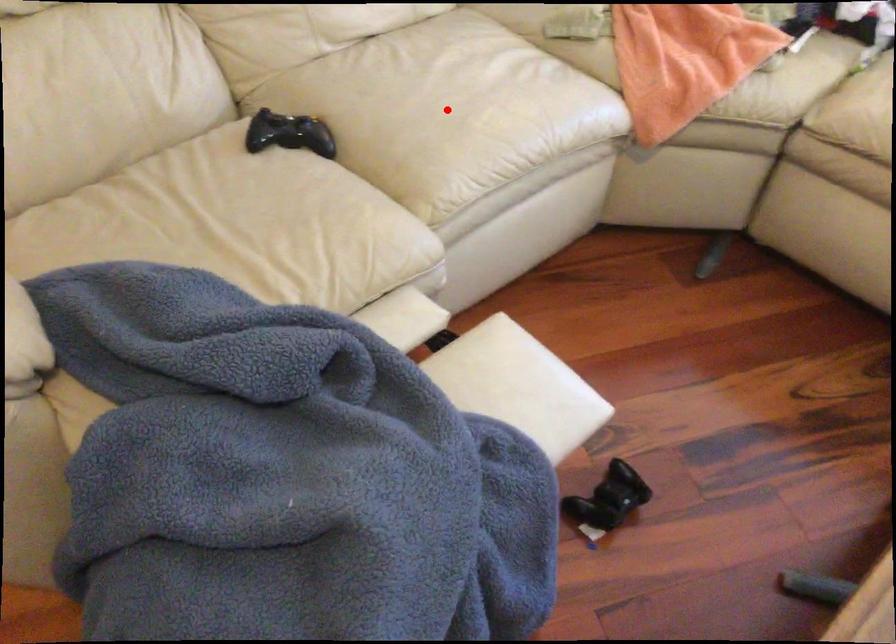
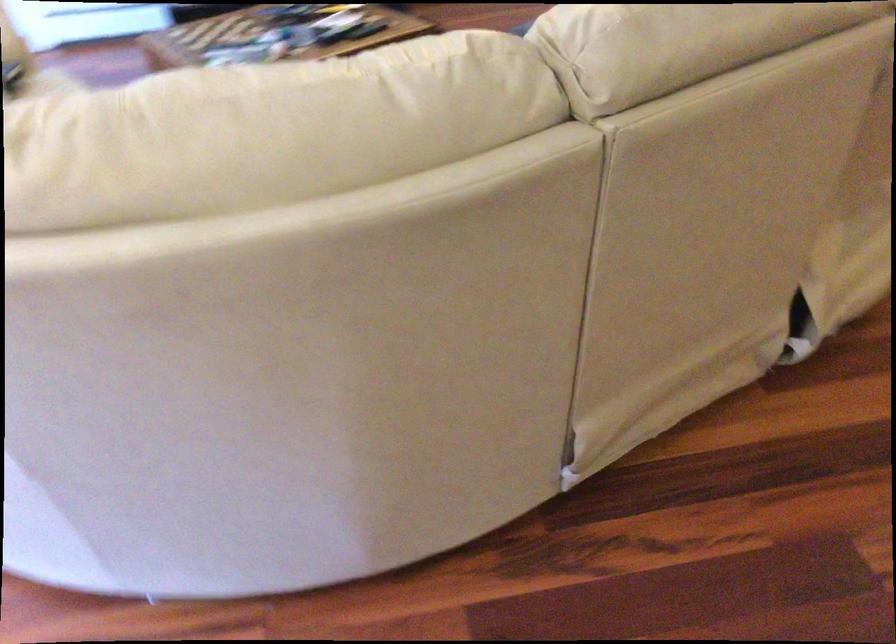
Question: I am providing you with two images of the same scene from different viewpoints. A red point is marked on the first image. Can you still see the location of the red point in image 2?

Choices:
 (A) Yes
 (B) No

Answer: (B)